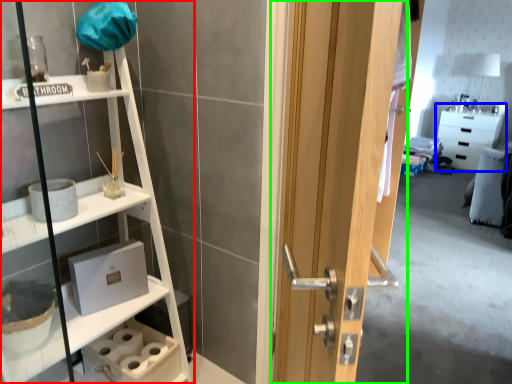
Question: Considering the real-world distances, which object is closest to shelf (highlighted by a red box)? cabinetry (highlighted by a blue box) or door (highlighted by a green box).

Choices:
 (A) cabinetry
 (B) door

Answer: (B)